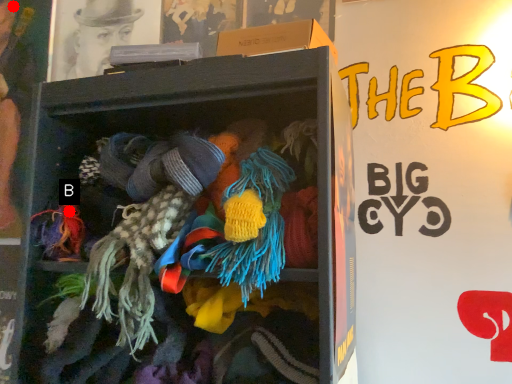
Question: Two points are circled on the image, labeled by A and B beside each circle. Which point is farther from the camera taking this photo?

Choices:
 (A) A is further
 (B) B is further

Answer: (A)